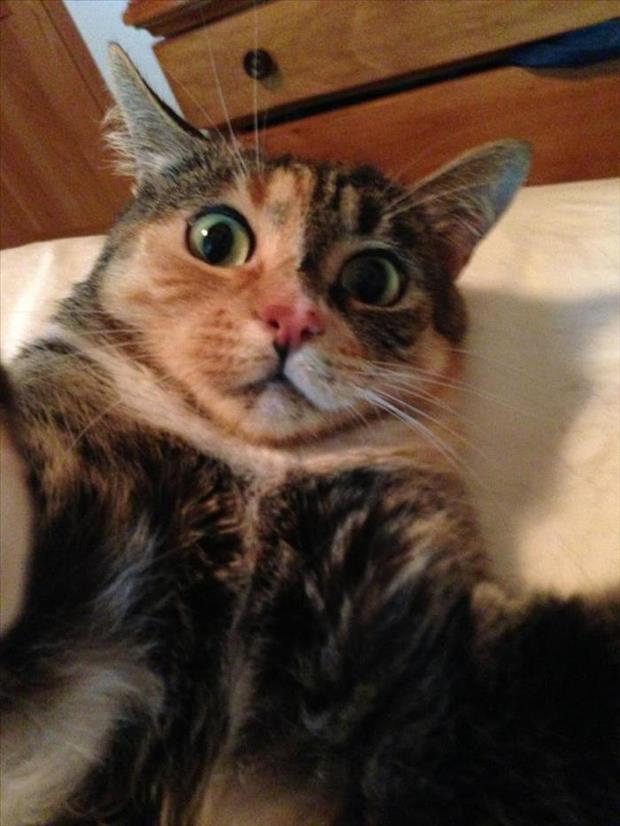
In order to click on wall in this screenshot , I will do `click(95, 6)`.